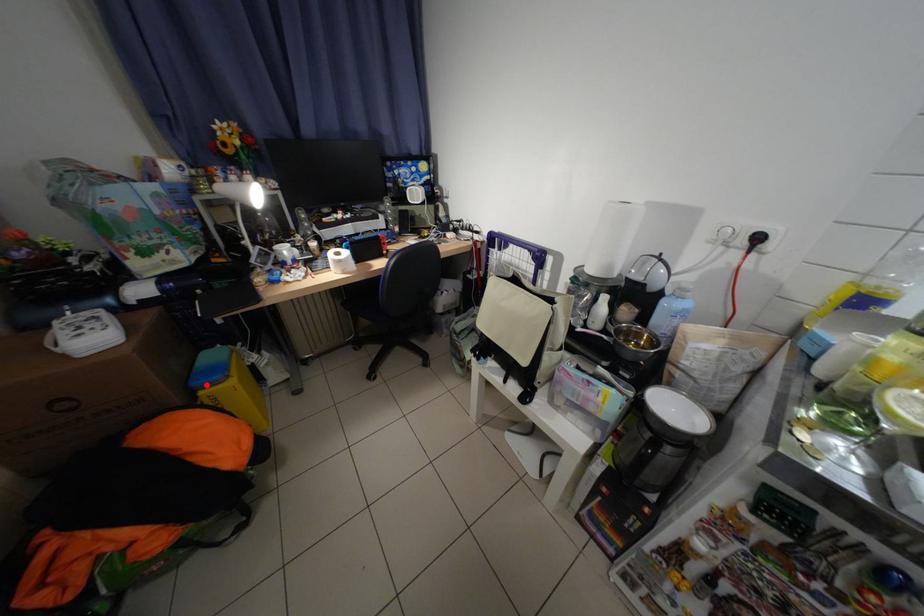
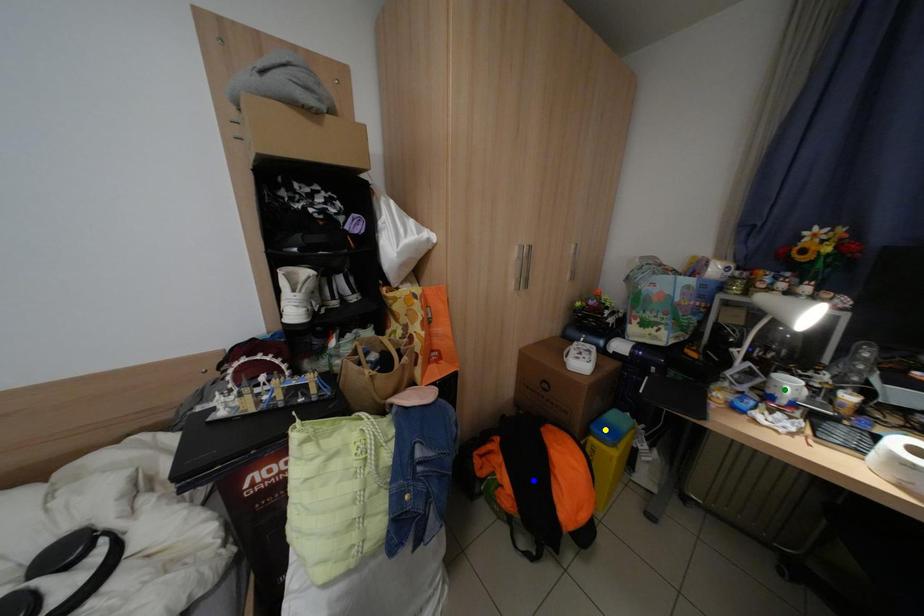
Question: I am providing you with two images of the same scene from different viewpoints. A red point is marked on the first image. You are given multiple points on the second image. In image 2, which mark is for the same physical point as the one in image 1?

Choices:
 (A) green point
 (B) yellow point
 (C) blue point

Answer: (B)